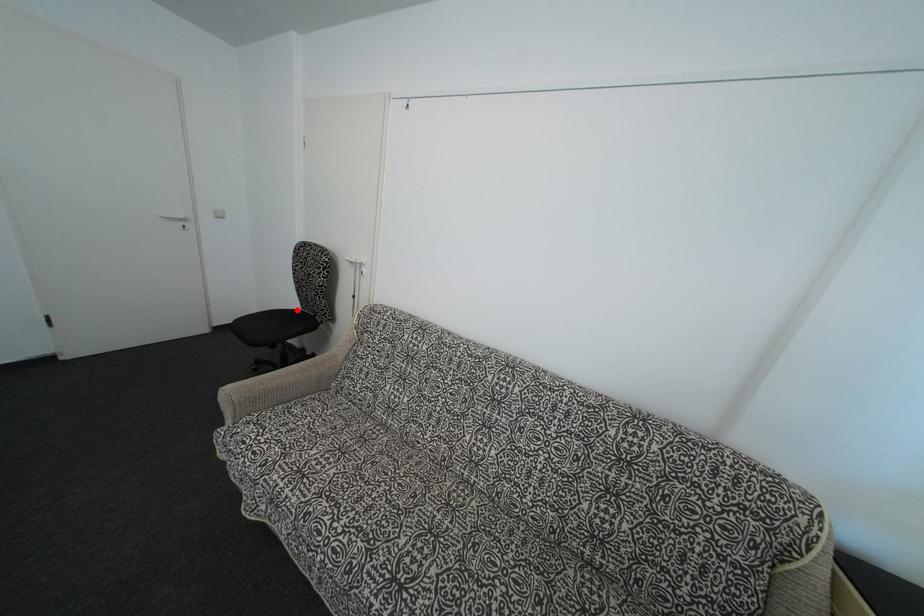
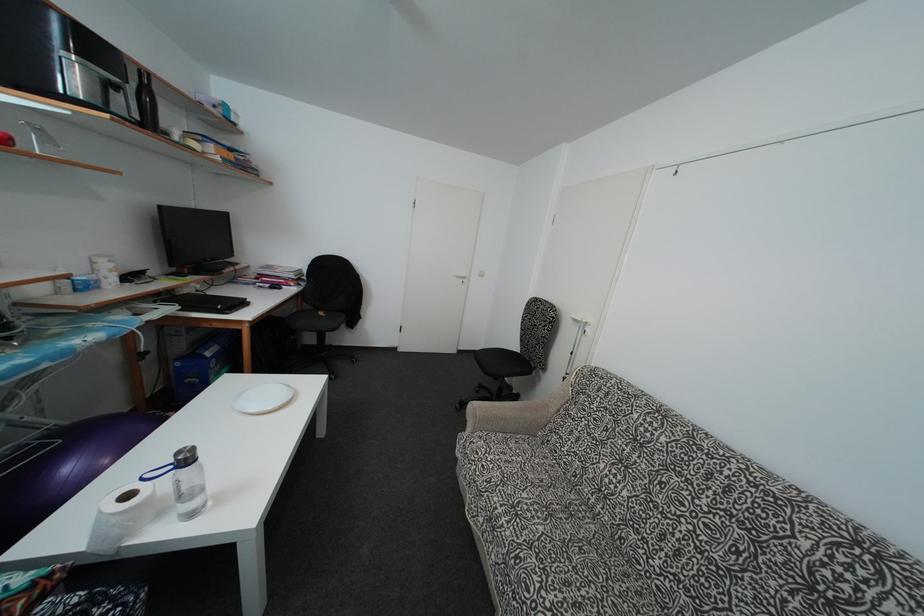
Question: I am providing you with two images of the same scene from different viewpoints. A red point is marked on the first image. Is the red point's position out of view in image 2?

Choices:
 (A) Yes
 (B) No

Answer: (B)